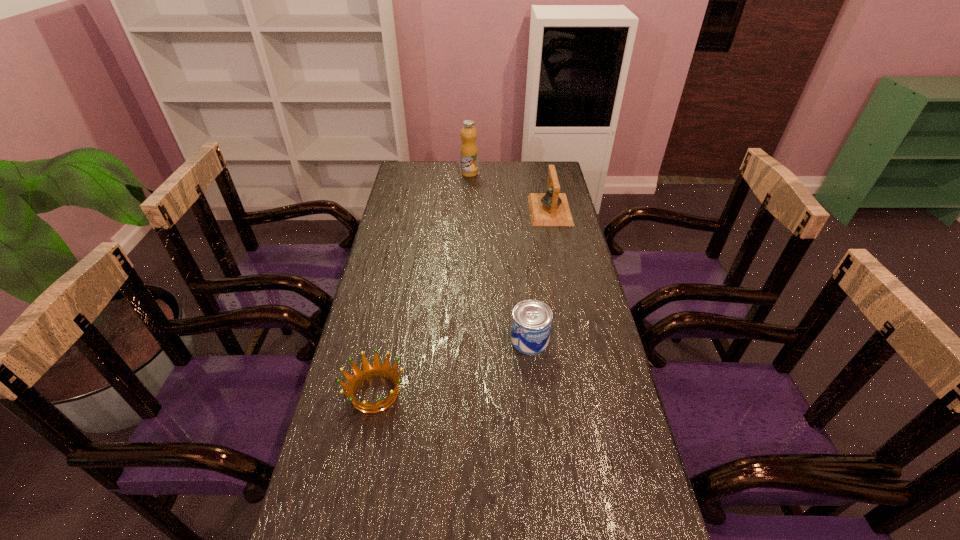
The width and height of the screenshot is (960, 540). In order to click on the tallest object in this screenshot , I will do `click(469, 151)`.

You are a GUI agent. You are given a task and a screenshot of the screen. Output one action in this format:
    pyautogui.click(x=<x>, y=<y>)
    Task: Click on the third object from right to left
    This screenshot has height=540, width=960.
    Given the screenshot: What is the action you would take?
    (469, 151)

This screenshot has height=540, width=960. What are the coordinates of `bell` in the screenshot? It's located at (551, 208).

Locate an element on the screen. This screenshot has width=960, height=540. the rightmost object is located at coordinates (551, 208).

At what (x,y) coordinates should I click in order to perform the action: click on the third tallest object. Please return your answer as a coordinate pair (x, y). The width and height of the screenshot is (960, 540). Looking at the image, I should click on (531, 320).

Identify the location of can. (531, 320).

You are a GUI agent. You are given a task and a screenshot of the screen. Output one action in this format:
    pyautogui.click(x=<x>, y=<y>)
    Task: Click on the leftmost object
    The width and height of the screenshot is (960, 540).
    Given the screenshot: What is the action you would take?
    pyautogui.click(x=368, y=371)

You are a GUI agent. You are given a task and a screenshot of the screen. Output one action in this format:
    pyautogui.click(x=<x>, y=<y>)
    Task: Click on the shortest object
    
    Given the screenshot: What is the action you would take?
    pyautogui.click(x=368, y=371)

What are the coordinates of `vacant point located 0.350m on the front label of the farthest object` in the screenshot? It's located at (555, 173).

Find the location of a particular element. The height and width of the screenshot is (540, 960). free space located 0.100m on the front of the rightmost object is located at coordinates (557, 242).